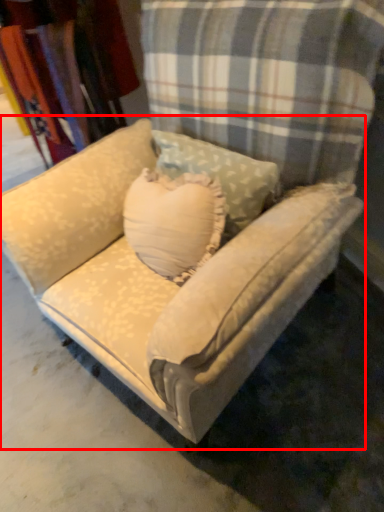
Question: From the image, what is the correct spatial relationship of studio couch (annotated by the red box) in relation to fabric?

Choices:
 (A) right
 (B) left

Answer: (A)